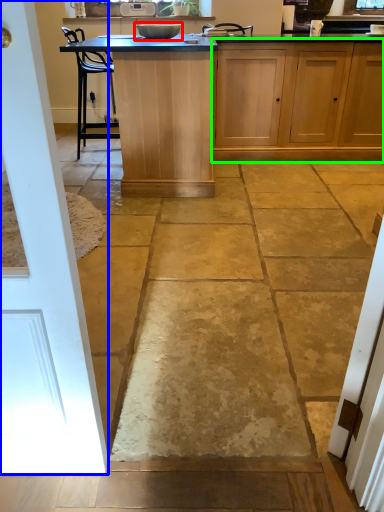
Question: Which object is the closest to the appliance (highlighted by a red box)? Choose among these: door (highlighted by a blue box) or cabinetry (highlighted by a green box).

Choices:
 (A) door
 (B) cabinetry

Answer: (B)